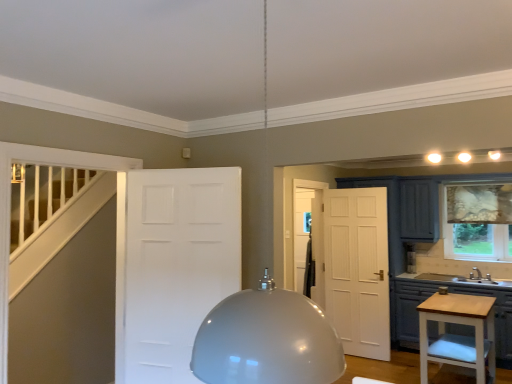
You are a GUI agent. You are given a task and a screenshot of the screen. Output one action in this format:
    pyautogui.click(x=<x>, y=<y>)
    Task: Click on the vacant space situated above white matte door at center (from a real-world perspective)
    The height and width of the screenshot is (384, 512).
    Given the screenshot: What is the action you would take?
    pyautogui.click(x=181, y=171)